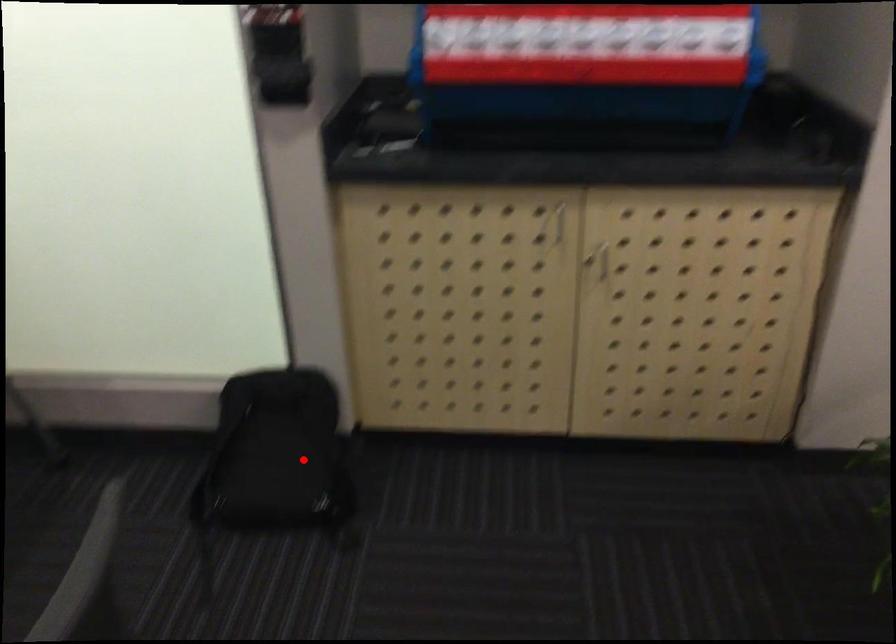
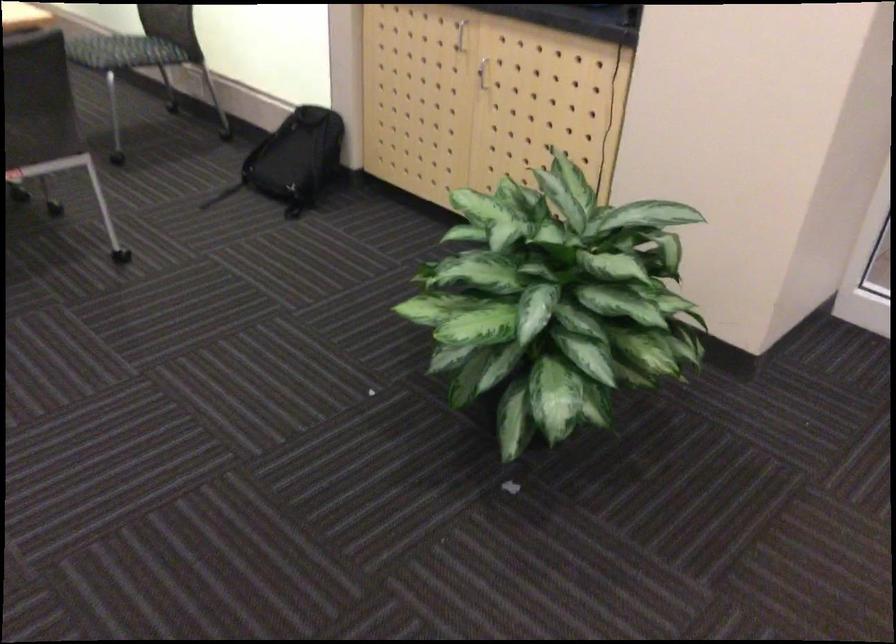
Question: I am providing you with two images of the same scene from different viewpoints. In image1, a red point is highlighted. Considering the same 3D point in image2, which of the following is correct?

Choices:
 (A) It is closer
 (B) It is farther

Answer: (B)